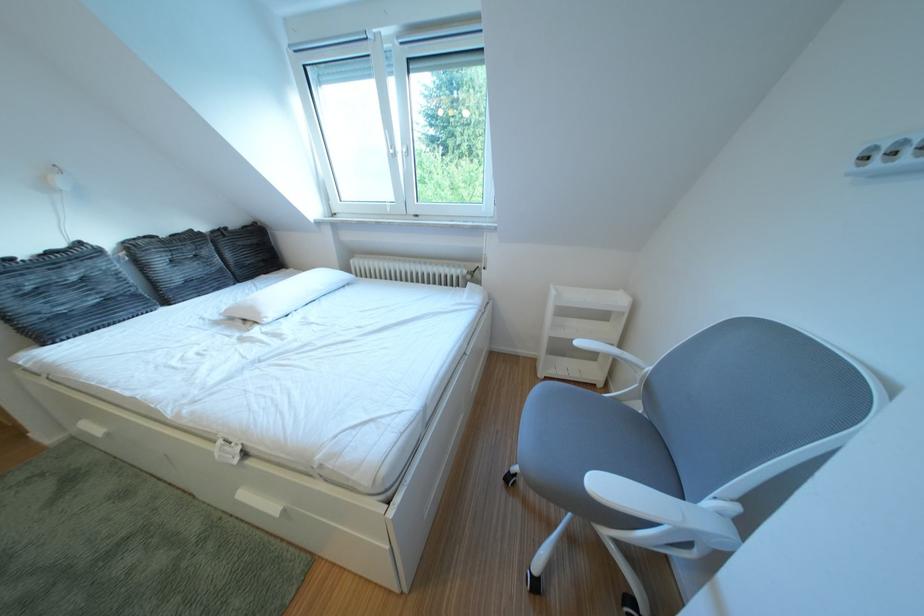
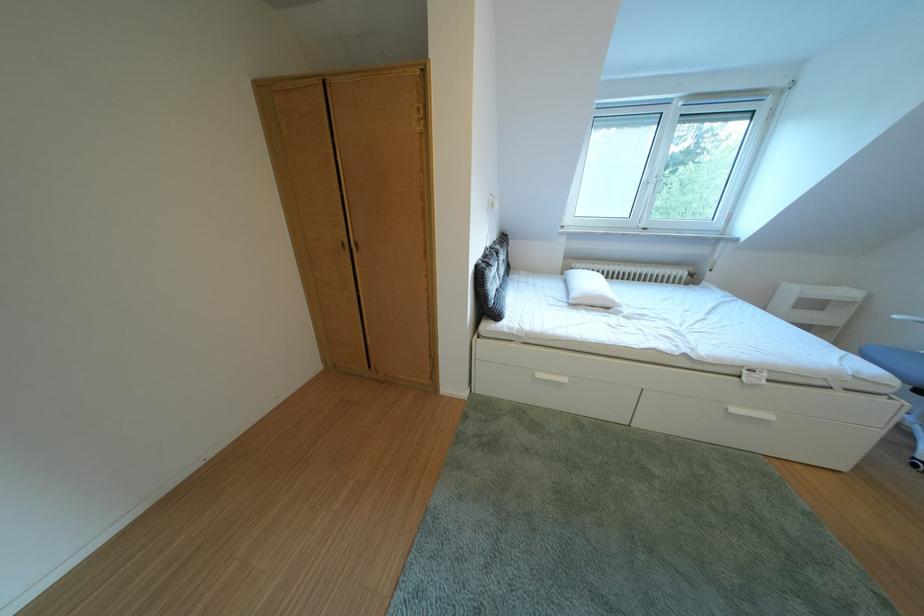
In the second image, find the point that corresponds to the point at 137,249 in the first image.

(505, 254)